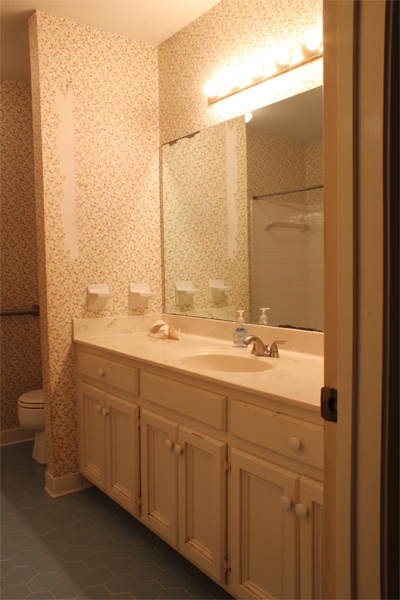
This screenshot has width=400, height=600. I want to click on mirror, so click(x=256, y=239).